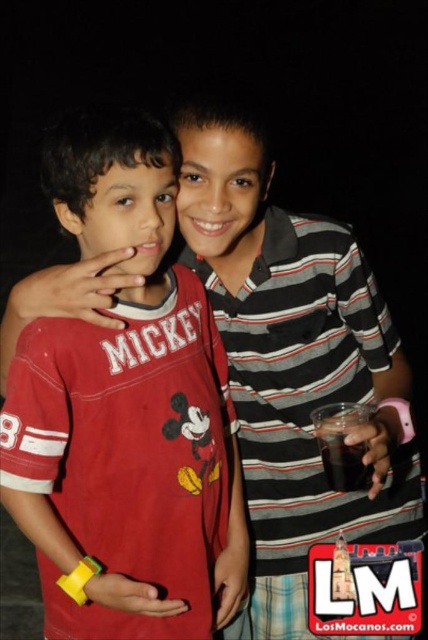
Can you confirm if red cotton shirt at center is shorter than dark brown liquid at right?

No, red cotton shirt at center is not shorter than dark brown liquid at right.

Which of these two, red cotton shirt at center or dark brown liquid at right, stands shorter?

dark brown liquid at right

Between point (225, 552) and point (333, 404), which one is positioned in front?

Point (333, 404)

Find the location of `red cotton shirt at center`. red cotton shirt at center is located at coordinates (127, 413).